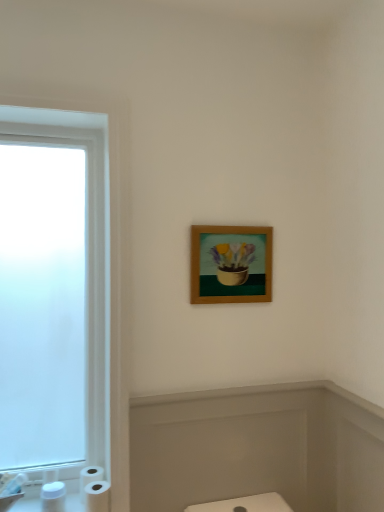
Describe the element at coordinates (53, 497) in the screenshot. I see `white matte toilet paper at lower left` at that location.

The image size is (384, 512). What do you see at coordinates (10, 490) in the screenshot? I see `white glossy sink at lower left` at bounding box center [10, 490].

Identify the location of white matte toilet paper at lower left. The width and height of the screenshot is (384, 512). (94, 489).

From the picture: Which is correct: white glossy sink at lower left is inside wooden frame at upper center, or outside of it?

white glossy sink at lower left is not inside wooden frame at upper center, it's outside.

Is the position of white glossy sink at lower left more distant than that of wooden frame at upper center?

No, white glossy sink at lower left is in front of wooden frame at upper center.

Considering the points (3, 496) and (240, 242), which point is behind, point (3, 496) or point (240, 242)?

The point (240, 242) is farther from the camera.

Considering the sizes of objects white matte toilet paper at lower left and wooden frame at upper center in the image provided, who is smaller, white matte toilet paper at lower left or wooden frame at upper center?

white matte toilet paper at lower left is smaller.

Which object is further away from the camera taking this photo, white matte toilet paper at lower left or wooden frame at upper center?

Positioned behind is wooden frame at upper center.

From the image's perspective, which one is positioned higher, white matte toilet paper at lower left or wooden frame at upper center?

wooden frame at upper center.

The height and width of the screenshot is (512, 384). I want to click on picture frame located above the white matte toilet paper at lower left (from the image's perspective), so click(231, 264).

Which of these two, white matte toilet paper at lower left or wooden frame at upper center, stands shorter?

Standing shorter between the two is white matte toilet paper at lower left.

Which is closer to the camera, (87, 468) or (194, 267)?

Point (87, 468).

Between white matte toilet paper at lower left and wooden frame at upper center, which one appears on the left side from the viewer's perspective?

white matte toilet paper at lower left.

From a real-world perspective, which object stands above the other?

From a 3D spatial view, white glossy sink at lower left is above.

Considering the sizes of objects white matte toilet paper at lower left and white glossy sink at lower left in the image provided, who is thinner, white matte toilet paper at lower left or white glossy sink at lower left?

white matte toilet paper at lower left.

Identify the location of sink in front of the white matte toilet paper at lower left. This screenshot has height=512, width=384. (10, 490).

From the image's perspective, which is below, white matte toilet paper at lower left or white glossy sink at lower left?

From the image's view, white matte toilet paper at lower left is below.

Is matte white bathtub at lower center looking in the opposite direction of white matte toilet paper at lower left?

No, matte white bathtub at lower center's orientation is not away from white matte toilet paper at lower left.

Which is in front, matte white bathtub at lower center or white matte toilet paper at lower left?

matte white bathtub at lower center is more forward.

The image size is (384, 512). Find the location of `bath that appears above the white matte toilet paper at lower left (from a real-world perspective)`. bath that appears above the white matte toilet paper at lower left (from a real-world perspective) is located at coordinates (257, 448).

Considering the sizes of matte white bathtub at lower center and white matte toilet paper at lower left in the image, is matte white bathtub at lower center wider or thinner than white matte toilet paper at lower left?

Considering their sizes, matte white bathtub at lower center looks slimmer than white matte toilet paper at lower left.

Is matte white bathtub at lower center further to camera compared to white matte toilet paper at lower left?

Yes, it is.

From a real-world perspective, is matte white bathtub at lower center above or below white matte toilet paper at lower left?

Clearly, from a real-world perspective, matte white bathtub at lower center is above white matte toilet paper at lower left.

In terms of width, does wooden frame at upper center look wider or thinner when compared to matte white bathtub at lower center?

Considering their sizes, wooden frame at upper center looks slimmer than matte white bathtub at lower center.

Is wooden frame at upper center with matte white bathtub at lower center?

No, wooden frame at upper center is not beside matte white bathtub at lower center.

Does wooden frame at upper center lie in front of matte white bathtub at lower center?

That is False.

From a real-world perspective, is wooden frame at upper center above or below matte white bathtub at lower center?

wooden frame at upper center is situated higher than matte white bathtub at lower center in the real world.

Find the location of `sink lying below the wooden frame at upper center (from the image's perspective)`. sink lying below the wooden frame at upper center (from the image's perspective) is located at coordinates (10, 490).

Locate an element on the screen. picture frame above the white matte toilet paper at lower left (from the image's perspective) is located at coordinates (231, 264).

In the scene shown: From the image, which object appears to be nearer to white glossy sink at lower left, white matte toilet paper at lower left or matte white bathtub at lower center?

Among the two, white matte toilet paper at lower left is located nearer to white glossy sink at lower left.

From the image, which object appears to be farther from white glossy sink at lower left, white matte toilet paper at lower left or wooden frame at upper center?

wooden frame at upper center.

Estimate the real-world distances between objects in this image. Which object is further from white matte toilet paper at lower left, wooden frame at upper center or white matte toilet paper at lower left?

Based on the image, wooden frame at upper center appears to be further to white matte toilet paper at lower left.

From the image, which object appears to be nearer to white glossy sink at lower left, white matte toilet paper at lower left or white matte toilet paper at lower left?

Among the two, white matte toilet paper at lower left is located nearer to white glossy sink at lower left.

Considering their positions, is wooden frame at upper center positioned further to matte white bathtub at lower center than white matte toilet paper at lower left?

white matte toilet paper at lower left.

When comparing their distances from wooden frame at upper center, does white matte toilet paper at lower left or white glossy sink at lower left seem further?

white glossy sink at lower left is further to wooden frame at upper center.

From the image, which object appears to be farther from white matte toilet paper at lower left, wooden frame at upper center or white glossy sink at lower left?

Among the two, wooden frame at upper center is located further to white matte toilet paper at lower left.

Which object lies further to the anchor point white glossy sink at lower left, wooden frame at upper center or matte white bathtub at lower center?

Based on the image, wooden frame at upper center appears to be further to white glossy sink at lower left.

The image size is (384, 512). In order to click on sink between wooden frame at upper center and white matte toilet paper at lower left from top to bottom in this screenshot , I will do `click(10, 490)`.

Where is `toiletry between white glossy sink at lower left and matte white bathtub at lower center from left to right`? This screenshot has height=512, width=384. toiletry between white glossy sink at lower left and matte white bathtub at lower center from left to right is located at coordinates (53, 497).

Where is `bath between wooden frame at upper center and white matte toilet paper at lower left vertically`? bath between wooden frame at upper center and white matte toilet paper at lower left vertically is located at coordinates (257, 448).

This screenshot has height=512, width=384. I want to click on toiletry between white glossy sink at lower left and white matte toilet paper at lower left from left to right, so (x=53, y=497).